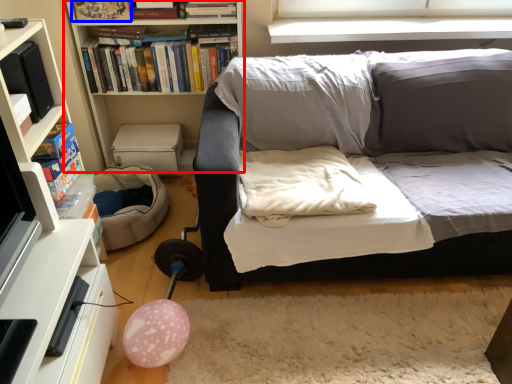
Question: Among these objects, which one is farthest to the camera, cabinetry (highlighted by a red box) or book (highlighted by a blue box)?

Choices:
 (A) cabinetry
 (B) book

Answer: (A)